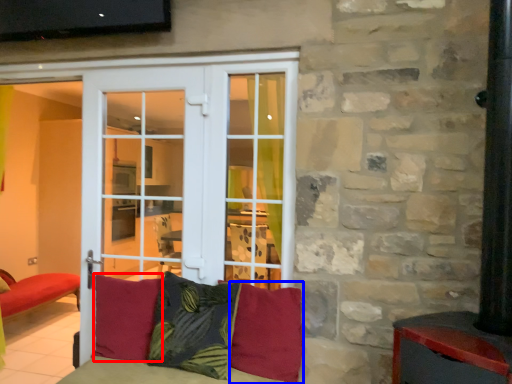
Question: Among these objects, which one is farthest to the camera, pillow (highlighted by a red box) or pillow (highlighted by a blue box)?

Choices:
 (A) pillow
 (B) pillow

Answer: (A)